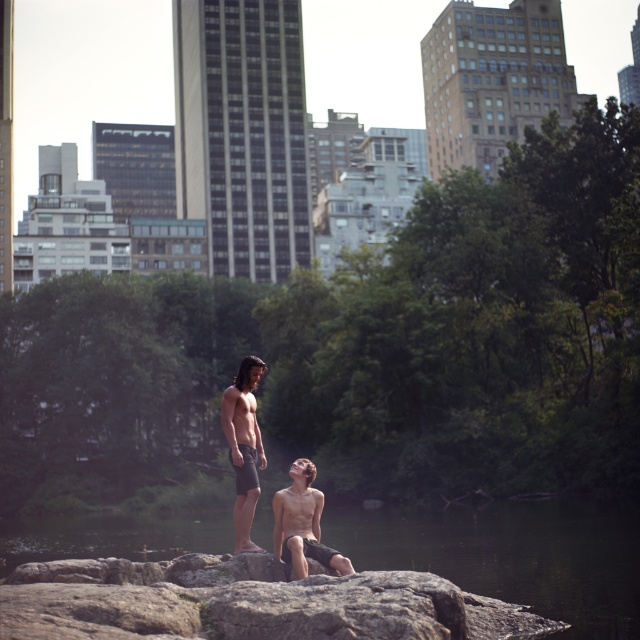
From the picture: Which of these two, dark gray stone river at center or matte black shorts at center, stands taller?

dark gray stone river at center

Which is in front, point (509, 588) or point (282, 529)?

Positioned in front is point (282, 529).

I want to click on dark gray stone river at center, so click(x=513, y=554).

Based on the photo, which is below, smooth skin woman at center or matte black shorts at center?

smooth skin woman at center is lower down.

Is smooth skin woman at center above matte black shorts at center?

No.

Between point (236, 472) and point (298, 472), which one is positioned behind?

Point (236, 472)

Locate an element on the screen. smooth skin woman at center is located at coordinates (243, 445).

Which of these two, dark gray stone river at center or smooth skin woman at center, stands shorter?

smooth skin woman at center is shorter.

Between dark gray stone river at center and smooth skin woman at center, which one appears on the right side from the viewer's perspective?

dark gray stone river at center

Identify the location of dark gray stone river at center. The width and height of the screenshot is (640, 640). (513, 554).